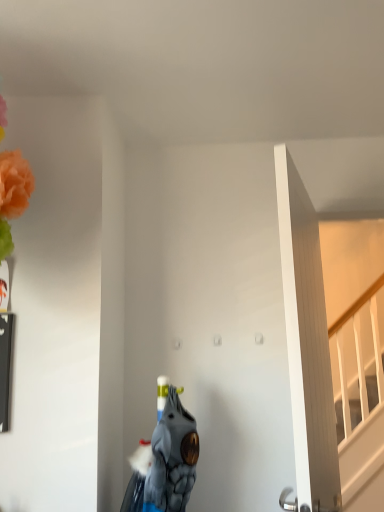
Find the location of a particular element. blue fabric animal at center is located at coordinates (165, 462).

This screenshot has width=384, height=512. Describe the element at coordinates (165, 462) in the screenshot. I see `blue fabric animal at center` at that location.

Where is `white wooden door at right`? white wooden door at right is located at coordinates (306, 342).

This screenshot has height=512, width=384. Describe the element at coordinates (306, 342) in the screenshot. I see `white wooden door at right` at that location.

The width and height of the screenshot is (384, 512). In order to click on blue fabric animal at center in this screenshot , I will do point(165,462).

Considering the relative positions of blue fabric animal at center and white wooden door at right in the image provided, is blue fabric animal at center to the left of white wooden door at right from the viewer's perspective?

Indeed, blue fabric animal at center is positioned on the left side of white wooden door at right.

In the image, is blue fabric animal at center positioned in front of or behind white wooden door at right?

In the image, blue fabric animal at center appears behind white wooden door at right.

Is point (185, 474) farther from camera compared to point (285, 211)?

Yes, point (185, 474) is behind point (285, 211).

From the image's perspective, is blue fabric animal at center beneath white wooden door at right?

Indeed, from the image's perspective, blue fabric animal at center is shown beneath white wooden door at right.

From a real-world perspective, is blue fabric animal at center positioned under white wooden door at right based on gravity?

Indeed, from a real-world perspective, blue fabric animal at center is positioned beneath white wooden door at right.

Does blue fabric animal at center have a greater width compared to white wooden door at right?

Indeed, blue fabric animal at center has a greater width compared to white wooden door at right.

Which of these two, blue fabric animal at center or white wooden door at right, stands taller?

Standing taller between the two is white wooden door at right.

Can you confirm if blue fabric animal at center is smaller than white wooden door at right?

Correct, blue fabric animal at center occupies less space than white wooden door at right.

Would you say blue fabric animal at center is inside or outside white wooden door at right?

blue fabric animal at center lies outside white wooden door at right.

Is blue fabric animal at center beside white wooden door at right?

No, blue fabric animal at center is not next to white wooden door at right.

Is blue fabric animal at center aimed at white wooden door at right?

No, blue fabric animal at center is not aimed at white wooden door at right.

How different are the orientations of blue fabric animal at center and white wooden door at right in degrees?

66.6 degrees separate the facing orientations of blue fabric animal at center and white wooden door at right.

What are the coordinates of `animal below the white wooden door at right (from the image's perspective)` in the screenshot? It's located at (165, 462).

Which is more to the right, white wooden door at right or blue fabric animal at center?

white wooden door at right.

Which is in front, white wooden door at right or blue fabric animal at center?

white wooden door at right.

Which is less distant, (x=327, y=509) or (x=156, y=467)?

Point (x=327, y=509) is farther from the camera than point (x=156, y=467).

From the image's perspective, which object appears higher, white wooden door at right or blue fabric animal at center?

From the image's view, white wooden door at right is above.

From a real-world perspective, does white wooden door at right sit lower than blue fabric animal at center?

No, from a real-world perspective, white wooden door at right is not below blue fabric animal at center.

In the scene shown: Which object is thinner, white wooden door at right or blue fabric animal at center?

white wooden door at right.

In terms of height, does white wooden door at right look taller or shorter compared to blue fabric animal at center?

In the image, white wooden door at right appears to be taller than blue fabric animal at center.

Which of these two, white wooden door at right or blue fabric animal at center, is bigger?

With larger size is white wooden door at right.

Is blue fabric animal at center completely or partially inside white wooden door at right?

No, blue fabric animal at center is located outside of white wooden door at right.

Is there a large distance between white wooden door at right and blue fabric animal at center?

No.

Is white wooden door at right turned away from blue fabric animal at center?

Correct, white wooden door at right is looking away from blue fabric animal at center.

How many degrees apart are the facing directions of white wooden door at right and blue fabric animal at center?

white wooden door at right and blue fabric animal at center are facing 66.6 degrees away from each other.

Find the location of a particular element. This screenshot has width=384, height=512. door located above the blue fabric animal at center (from the image's perspective) is located at coordinates (306, 342).

Where is `door in front of the blue fabric animal at center`? This screenshot has width=384, height=512. door in front of the blue fabric animal at center is located at coordinates (306, 342).

I want to click on animal that appears below the white wooden door at right (from a real-world perspective), so click(165, 462).